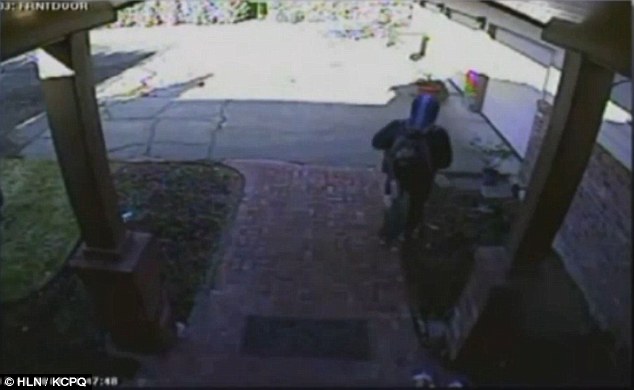
Locate an element on the screen. The height and width of the screenshot is (390, 634). pillars is located at coordinates (106, 298), (487, 318).